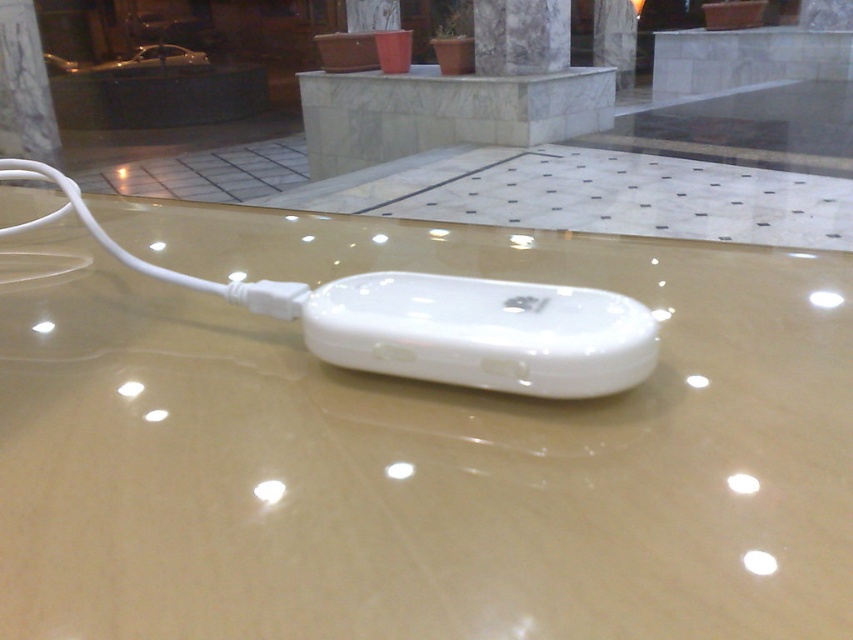
Which is below, transparent glossy glass table at center or white marble pillar at upper center?

transparent glossy glass table at center is below.

Can you confirm if transparent glossy glass table at center is thinner than white marble pillar at upper center?

In fact, transparent glossy glass table at center might be wider than white marble pillar at upper center.

Which is behind, point (114, 275) or point (508, 42)?

Point (508, 42)

You are a GUI agent. You are given a task and a screenshot of the screen. Output one action in this format:
    pyautogui.click(x=<x>, y=<y>)
    Task: Click on the transparent glossy glass table at center
    
    Given the screenshot: What is the action you would take?
    pyautogui.click(x=413, y=448)

Is transparent glossy glass table at center taller than white glossy ipod at center?

Answer: Correct, transparent glossy glass table at center is much taller as white glossy ipod at center.

Is point (39, 513) closer to viewer compared to point (567, 388)?

Yes, it is.

What are the coordinates of `transparent glossy glass table at center` in the screenshot? It's located at pyautogui.click(x=413, y=448).

Is white glossy ipod at center in front of white marble pillar at upper center?

That is True.

Between white glossy ipod at center and white marble pillar at upper center, which one is positioned lower?

Positioned lower is white glossy ipod at center.

Does point (608, 381) lie behind point (520, 26)?

No, (608, 381) is in front of (520, 26).

Locate an element on the screen. white glossy ipod at center is located at coordinates (482, 332).